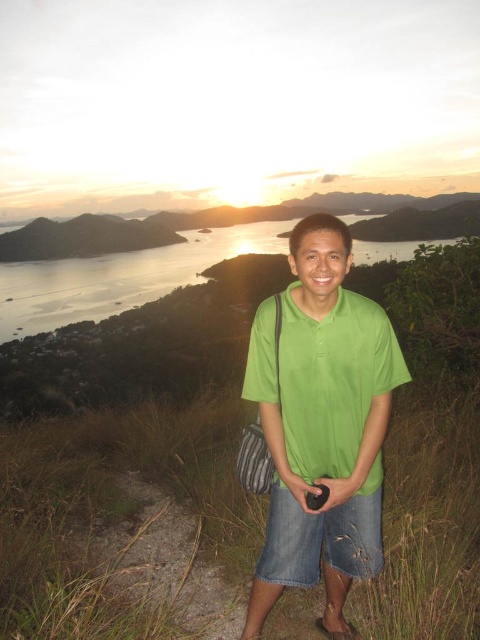
Question: Which object is closer to the camera taking this photo?

Choices:
 (A) green cotton shirt at center
 (B) denim shorts at lower center

Answer: (A)

Question: Is green cotton shirt at center to the left of denim shorts at lower center from the viewer's perspective?

Choices:
 (A) yes
 (B) no

Answer: (B)

Question: Is green cotton shirt at center closer to camera compared to denim shorts at lower center?

Choices:
 (A) yes
 (B) no

Answer: (A)

Question: Where is green cotton shirt at center located in relation to denim shorts at lower center in the image?

Choices:
 (A) below
 (B) above

Answer: (B)

Question: Which object appears closest to the camera in this image?

Choices:
 (A) green cotton shirt at center
 (B) denim shorts at lower center

Answer: (A)

Question: Which of the following is the closest to the observer?

Choices:
 (A) (345, 544)
 (B) (303, 461)

Answer: (B)